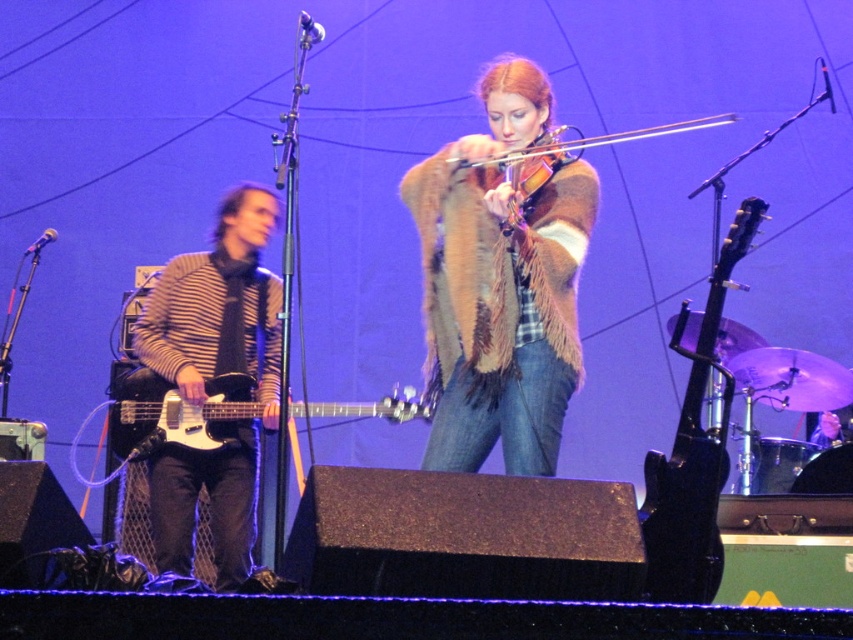
You are a photographer trying to capture the musician in the middle of the stage. You notice the striped knit sweater at left and the black glossy electric guitar at right. Which object is covering part of the other?

The striped knit sweater at left is positioned over the black glossy electric guitar at right, so the sweater is covering part of the guitar.

You are sitting in the audience watching the live performance. There are two points marked on the stage at coordinates point [550,145] and point [672,125]. Which point is closer to you?

Point [550,145] is closer to the viewer than point [672,125].